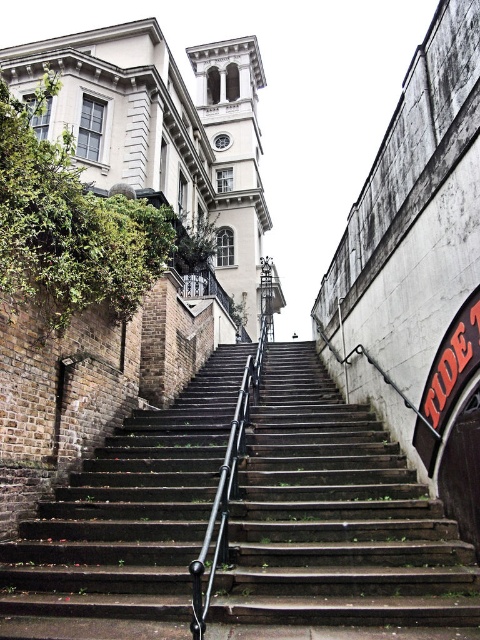
Locate an element on the screen. The image size is (480, 640). dark brown wooden stairs at center is located at coordinates (335, 516).

Does dark brown wooden stairs at center have a greater height compared to black metal/rail at center?

In fact, dark brown wooden stairs at center may be shorter than black metal/rail at center.

The width and height of the screenshot is (480, 640). In order to click on dark brown wooden stairs at center in this screenshot , I will do `click(335, 516)`.

Find the location of a particular element. The height and width of the screenshot is (640, 480). dark brown wooden stairs at center is located at coordinates (335, 516).